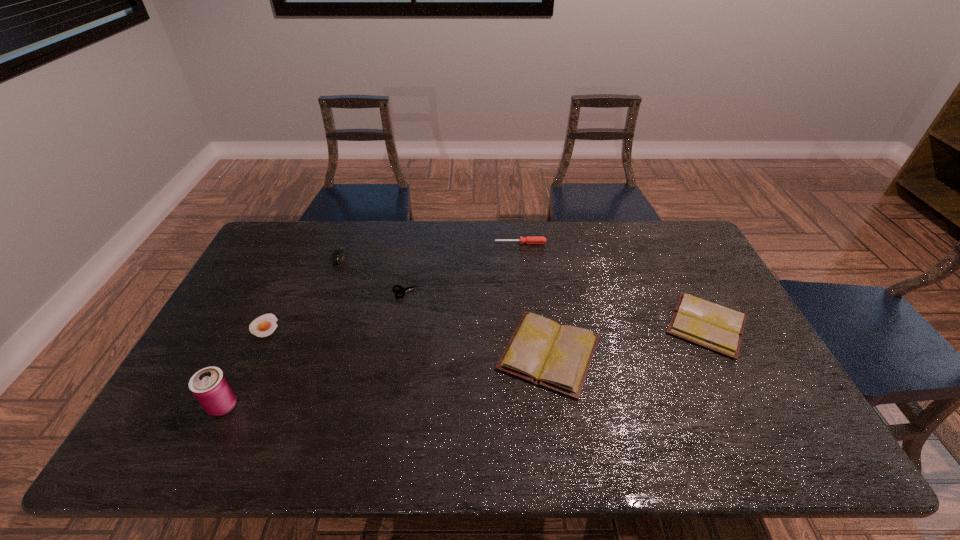
Please point a spot on the left to add another diary. Please provide its 2D coordinates. Your answer should be formatted as a tuple, i.e. [(x, y)], where the tuple contains the x and y coordinates of a point satisfying the conditions above.

[(371, 385)]